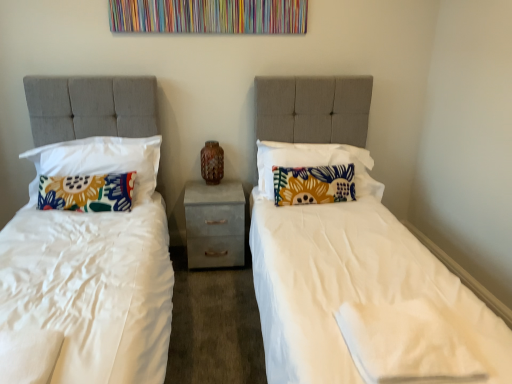
The height and width of the screenshot is (384, 512). What do you see at coordinates (99, 161) in the screenshot?
I see `floral fabric pillow at left, positioned as the 2th pillow in left-to-right order` at bounding box center [99, 161].

Find the location of a particular element. metallic gray nightstand at center is located at coordinates (215, 224).

In order to face brown textured vase at center, should I rotate leftwards or rightwards?

You should rotate left by 5.641 degrees.

What are the coordinates of `floral fabric pillow at center, which is the third pillow in left-to-right order` in the screenshot? It's located at (313, 184).

This screenshot has width=512, height=384. What do you see at coordinates (315, 163) in the screenshot?
I see `floral fabric pillow at center, which is the first pillow in right-to-left order` at bounding box center [315, 163].

This screenshot has width=512, height=384. What are the coordinates of `floral fabric pillow at left, positioned as the 2th pillow in left-to-right order` in the screenshot? It's located at (99, 161).

Can you tell me how much floral fabric pillow at left, marked as the first pillow in a left-to-right arrangement, and metallic gray nightstand at center differ in facing direction?

There is a 178-degree angle between the facing directions of floral fabric pillow at left, marked as the first pillow in a left-to-right arrangement, and metallic gray nightstand at center.

Is floral fabric pillow at left, which is counted as the 4th pillow, starting from the right, looking in the opposite direction of metallic gray nightstand at center?

floral fabric pillow at left, which is counted as the 4th pillow, starting from the right, does not have its back to metallic gray nightstand at center.

Is point (130, 187) behind point (188, 197)?

No, (130, 187) is closer to viewer.

Looking at their sizes, would you say floral fabric pillow at left, which is counted as the 4th pillow, starting from the right, is wider or thinner than metallic gray nightstand at center?

In the image, floral fabric pillow at left, which is counted as the 4th pillow, starting from the right, appears to be more narrow than metallic gray nightstand at center.

Which of these two, metallic gray nightstand at center or floral fabric pillow at center, which is the second pillow in right-to-left order, is smaller?

With smaller size is floral fabric pillow at center, which is the second pillow in right-to-left order.

Measure the distance from metallic gray nightstand at center to floral fabric pillow at center, which is the second pillow in right-to-left order.

A distance of 18.70 inches exists between metallic gray nightstand at center and floral fabric pillow at center, which is the second pillow in right-to-left order.

Is metallic gray nightstand at center to the right of floral fabric pillow at center, which is the second pillow in right-to-left order, from the viewer's perspective?

No.

From a real-world perspective, between metallic gray nightstand at center and floral fabric pillow at center, which is the second pillow in right-to-left order, who is vertically lower?

metallic gray nightstand at center is physically lower.

From the image's perspective, is floral fabric pillow at left, arranged as the third pillow when viewed from the right, on brown textured vase at center?

No, from the image's perspective, floral fabric pillow at left, arranged as the third pillow when viewed from the right, is not over brown textured vase at center.

Does point (55, 146) appear closer or farther from the camera than point (204, 159)?

Point (55, 146) is positioned closer to the camera compared to point (204, 159).

From a real-world perspective, is floral fabric pillow at left, arranged as the third pillow when viewed from the right, beneath brown textured vase at center?

No, from a real-world perspective, floral fabric pillow at left, arranged as the third pillow when viewed from the right, is not under brown textured vase at center.

Which pillow is the 1st one when counting from the right side of the floral fabric pillow at left, arranged as the third pillow when viewed from the right? Please provide its 2D coordinates.

[(313, 184)]

Which of these two, floral fabric pillow at center, which is the second pillow in right-to-left order, or floral fabric pillow at left, positioned as the 2th pillow in left-to-right order, stands shorter?

Standing shorter between the two is floral fabric pillow at center, which is the second pillow in right-to-left order.

Is floral fabric pillow at center, which is the second pillow in right-to-left order, situated inside floral fabric pillow at left, positioned as the 2th pillow in left-to-right order, or outside?

floral fabric pillow at center, which is the second pillow in right-to-left order, is spatially situated outside floral fabric pillow at left, positioned as the 2th pillow in left-to-right order.

Is floral fabric pillow at center, which is the second pillow in right-to-left order, positioned far away from floral fabric pillow at left, arranged as the third pillow when viewed from the right?

Yes.

Does floral fabric pillow at center, acting as the 4th pillow starting from the left, have a lesser width compared to metallic gray nightstand at center?

Yes, floral fabric pillow at center, acting as the 4th pillow starting from the left, is thinner than metallic gray nightstand at center.

Is floral fabric pillow at center, which is the first pillow in right-to-left order, to the left of metallic gray nightstand at center from the viewer's perspective?

Incorrect, floral fabric pillow at center, which is the first pillow in right-to-left order, is not on the left side of metallic gray nightstand at center.

At what (x,y) coordinates should I click in order to perform the action: click on nightstand lying below the floral fabric pillow at center, which is the first pillow in right-to-left order (from the image's perspective). Please return your answer as a coordinate pair (x, y). Looking at the image, I should click on (215, 224).

What are the coordinates of `vase behind the floral fabric pillow at center, which is the first pillow in right-to-left order` in the screenshot? It's located at (212, 162).

Is brown textured vase at center directly adjacent to floral fabric pillow at center, acting as the 4th pillow starting from the left?

No, brown textured vase at center is not making contact with floral fabric pillow at center, acting as the 4th pillow starting from the left.

Which is less distant, (202, 169) or (280, 150)?

The point (280, 150) is more forward.

Measure the distance from brown textured vase at center to floral fabric pillow at center, which is the first pillow in right-to-left order.

brown textured vase at center is 22.57 inches away from floral fabric pillow at center, which is the first pillow in right-to-left order.

Would you say metallic gray nightstand at center is part of floral fabric pillow at center, which is the third pillow in left-to-right order,'s contents?

No, metallic gray nightstand at center is located outside of floral fabric pillow at center, which is the third pillow in left-to-right order.

How far apart are floral fabric pillow at center, which is the second pillow in right-to-left order, and metallic gray nightstand at center?

18.70 inches.

Is the position of floral fabric pillow at center, which is the third pillow in left-to-right order, more distant than that of metallic gray nightstand at center?

No, it is not.

Considering the sizes of objects floral fabric pillow at center, which is the second pillow in right-to-left order, and metallic gray nightstand at center in the image provided, who is shorter, floral fabric pillow at center, which is the second pillow in right-to-left order, or metallic gray nightstand at center?

floral fabric pillow at center, which is the second pillow in right-to-left order, is shorter.

Where is `nightstand below the floral fabric pillow at left, which is counted as the 4th pillow, starting from the right (from a real-world perspective)`? This screenshot has width=512, height=384. nightstand below the floral fabric pillow at left, which is counted as the 4th pillow, starting from the right (from a real-world perspective) is located at coordinates (215, 224).

The width and height of the screenshot is (512, 384). In order to click on the 1st pillow in front of the metallic gray nightstand at center, starting your count from the anchor in this screenshot , I will do `click(313, 184)`.

Based on their spatial positions, is floral fabric pillow at center, which is the first pillow in right-to-left order, or floral fabric pillow at left, which is counted as the 4th pillow, starting from the right, closer to floral fabric pillow at left, positioned as the 2th pillow in left-to-right order?

The object closer to floral fabric pillow at left, positioned as the 2th pillow in left-to-right order, is floral fabric pillow at left, which is counted as the 4th pillow, starting from the right.

Estimate the real-world distances between objects in this image. Which object is closer to brown textured vase at center, floral fabric pillow at center, which is the second pillow in right-to-left order, or floral fabric pillow at center, acting as the 4th pillow starting from the left?

The object closer to brown textured vase at center is floral fabric pillow at center, acting as the 4th pillow starting from the left.

When comparing their distances from floral fabric pillow at center, which is the third pillow in left-to-right order, does floral fabric pillow at center, which is the first pillow in right-to-left order, or metallic gray nightstand at center seem closer?

Based on the image, floral fabric pillow at center, which is the first pillow in right-to-left order, appears to be nearer to floral fabric pillow at center, which is the third pillow in left-to-right order.

Based on their spatial positions, is floral fabric pillow at left, marked as the first pillow in a left-to-right arrangement, or brown textured vase at center further from floral fabric pillow at center, which is the second pillow in right-to-left order?

The object further to floral fabric pillow at center, which is the second pillow in right-to-left order, is floral fabric pillow at left, marked as the first pillow in a left-to-right arrangement.

From the image, which object appears to be farther from floral fabric pillow at center, which is the second pillow in right-to-left order, metallic gray nightstand at center or floral fabric pillow at left, arranged as the third pillow when viewed from the right?

The object further to floral fabric pillow at center, which is the second pillow in right-to-left order, is floral fabric pillow at left, arranged as the third pillow when viewed from the right.

When comparing their distances from metallic gray nightstand at center, does floral fabric pillow at left, arranged as the third pillow when viewed from the right, or brown textured vase at center seem further?

floral fabric pillow at left, arranged as the third pillow when viewed from the right.

Which object lies nearer to the anchor point floral fabric pillow at left, which is counted as the 4th pillow, starting from the right, floral fabric pillow at center, acting as the 4th pillow starting from the left, or brown textured vase at center?

brown textured vase at center is closer to floral fabric pillow at left, which is counted as the 4th pillow, starting from the right.

Looking at this image, looking at the image, which one is located closer to floral fabric pillow at center, which is the second pillow in right-to-left order, floral fabric pillow at left, positioned as the 2th pillow in left-to-right order, or floral fabric pillow at center, acting as the 4th pillow starting from the left?

floral fabric pillow at center, acting as the 4th pillow starting from the left, is positioned closer to the anchor floral fabric pillow at center, which is the second pillow in right-to-left order.

Identify the location of vase located between floral fabric pillow at left, arranged as the third pillow when viewed from the right, and floral fabric pillow at center, which is the third pillow in left-to-right order, in the left-right direction. (212, 162).

In order to click on vase between floral fabric pillow at left, which is counted as the 4th pillow, starting from the right, and floral fabric pillow at center, which is the second pillow in right-to-left order, in the horizontal direction in this screenshot , I will do `click(212, 162)`.

At what (x,y) coordinates should I click in order to perform the action: click on vase situated between floral fabric pillow at left, positioned as the 2th pillow in left-to-right order, and floral fabric pillow at center, acting as the 4th pillow starting from the left, from left to right. Please return your answer as a coordinate pair (x, y). This screenshot has height=384, width=512. Looking at the image, I should click on (212, 162).

Find the location of a particular element. nightstand located between brown textured vase at center and floral fabric pillow at center, which is the first pillow in right-to-left order, in the left-right direction is located at coordinates (215, 224).